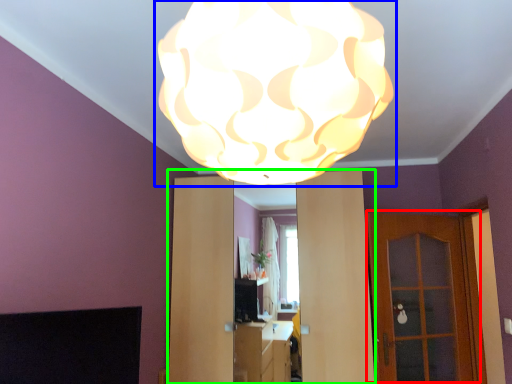
Question: Estimate the real-world distances between objects in this image. Which object is farther from door (highlighted by a red box), lamp (highlighted by a blue box) or dresser (highlighted by a green box)?

Choices:
 (A) lamp
 (B) dresser

Answer: (A)